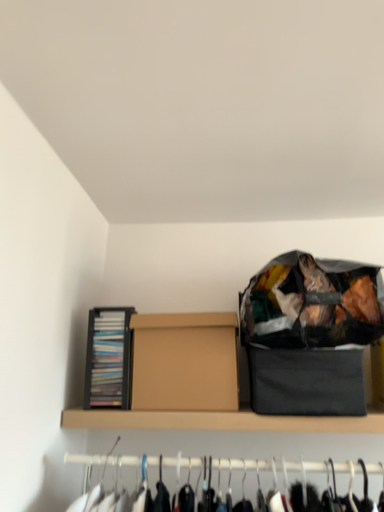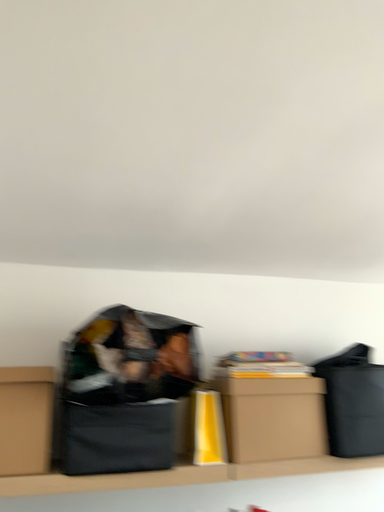
Question: How did the camera likely rotate when shooting the video?

Choices:
 (A) rotated right
 (B) rotated left

Answer: (A)